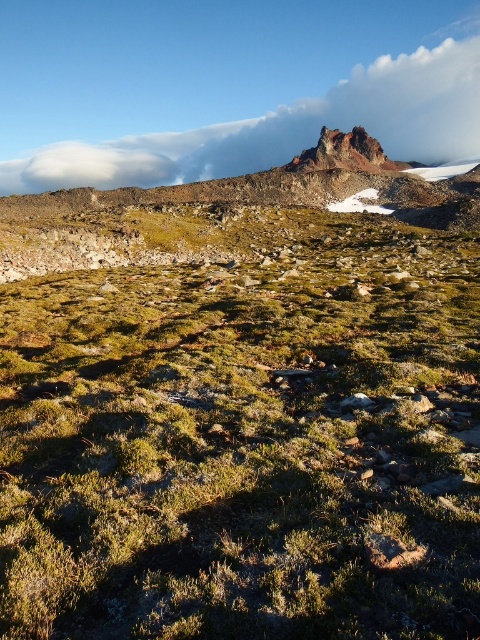
Based on the photo, you are a hiker planning to reach the point marked at coordinates (x=225, y=161) in the mountainous landscape. The trail you are currently on is 1500 meters long. Can you safely reach the point without exceeding the trail length?

The point marked at coordinates (x=225, y=161) is 1733.27 meters from the viewer, which is longer than the 1500 meters trail available. Therefore, you cannot safely reach the point without exceeding the trail length.

You are a hiker planning to take a photo of the rugged rock peak at upper center and the white fluffy cloud at upper center. Which object appears higher in the sky?

The white fluffy cloud at upper center appears higher in the sky than the rugged rock peak at upper center because it is taller according to the description.

You are standing at the base of the mountain in the rugged landscape. You notice a point marked at coordinates (286,129). What object is located at this point?

The point at (286,129) corresponds to the white fluffy cloud at upper center.